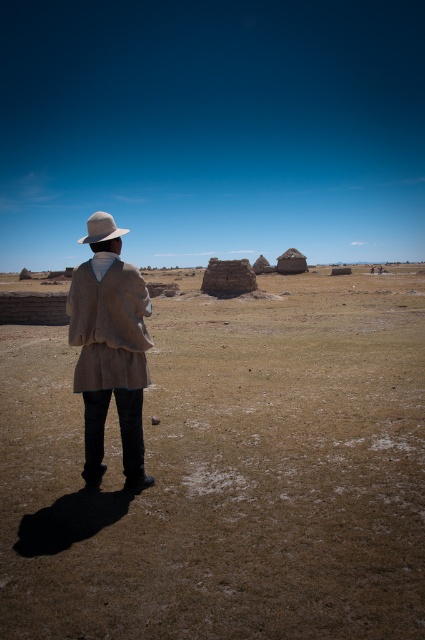
Question: Which object is positioned farthest from the beige woolen poncho at center?

Choices:
 (A) brown grassland at center
 (B) beige woolen trench coat at center
 (C) light beige felt fedora at back

Answer: (A)

Question: Can you confirm if brown grassland at center is thinner than light beige felt fedora at back?

Choices:
 (A) no
 (B) yes

Answer: (A)

Question: Considering the real-world distances, which object is closest to the light beige felt fedora at back?

Choices:
 (A) beige woolen trench coat at center
 (B) beige woolen poncho at center

Answer: (B)

Question: Can you confirm if beige woolen trench coat at center is positioned to the right of light beige felt fedora at back?

Choices:
 (A) no
 (B) yes

Answer: (B)

Question: Which of these objects is positioned farthest from the brown grassland at center?

Choices:
 (A) beige woolen trench coat at center
 (B) light beige felt fedora at back
 (C) beige woolen poncho at center

Answer: (A)

Question: Is brown grassland at center thinner than light beige felt fedora at back?

Choices:
 (A) no
 (B) yes

Answer: (A)